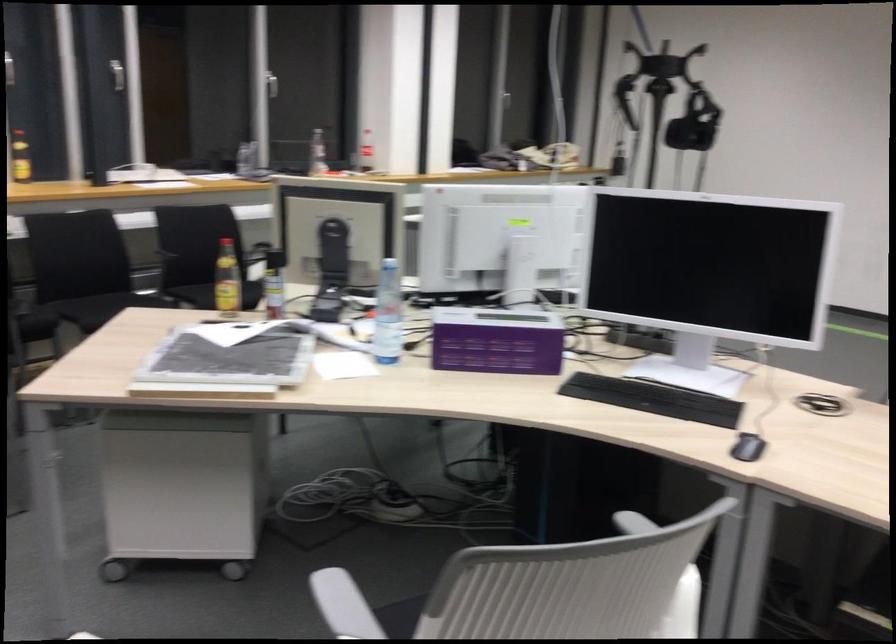
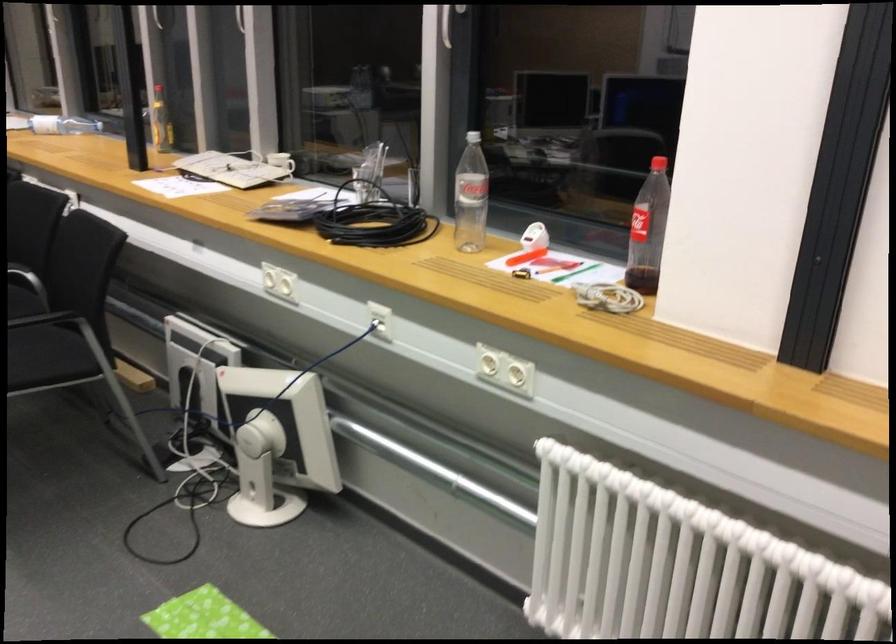
Locate, in the second image, the point that corresponds to (x=359, y=147) in the first image.

(648, 230)